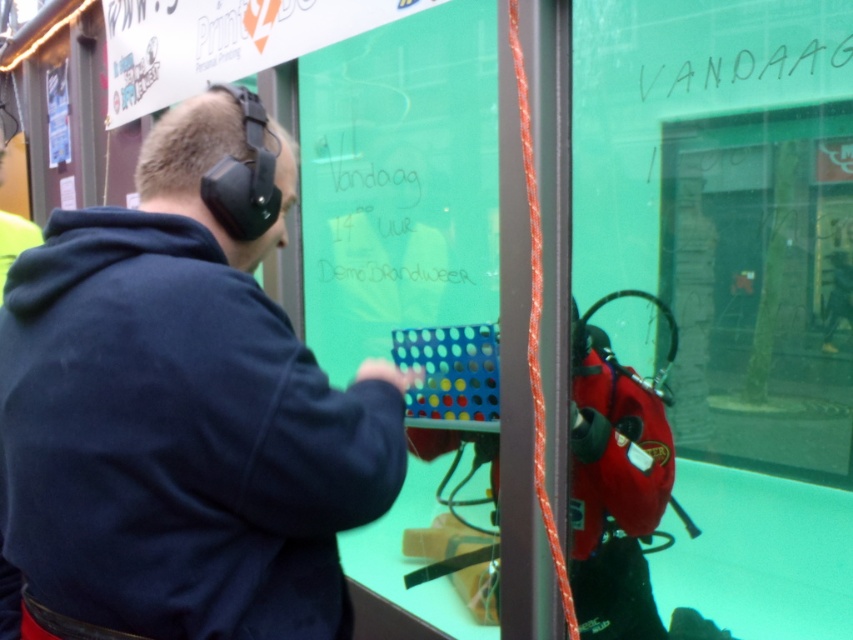
Can you confirm if dark blue hoodie at upper left is wider than black handwritten text at upper right?

Indeed, dark blue hoodie at upper left has a greater width compared to black handwritten text at upper right.

Does dark blue hoodie at upper left have a lesser width compared to black handwritten text at upper right?

Incorrect, dark blue hoodie at upper left's width is not less than black handwritten text at upper right's.

Find the location of `dark blue hoodie at upper left`. dark blue hoodie at upper left is located at coordinates (181, 410).

Locate an element on the screen. dark blue hoodie at upper left is located at coordinates (181, 410).